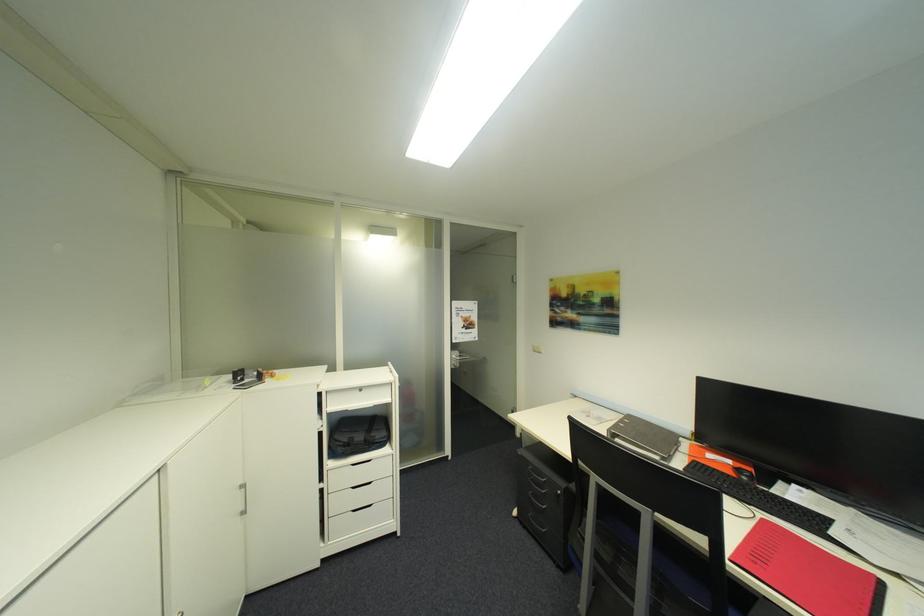
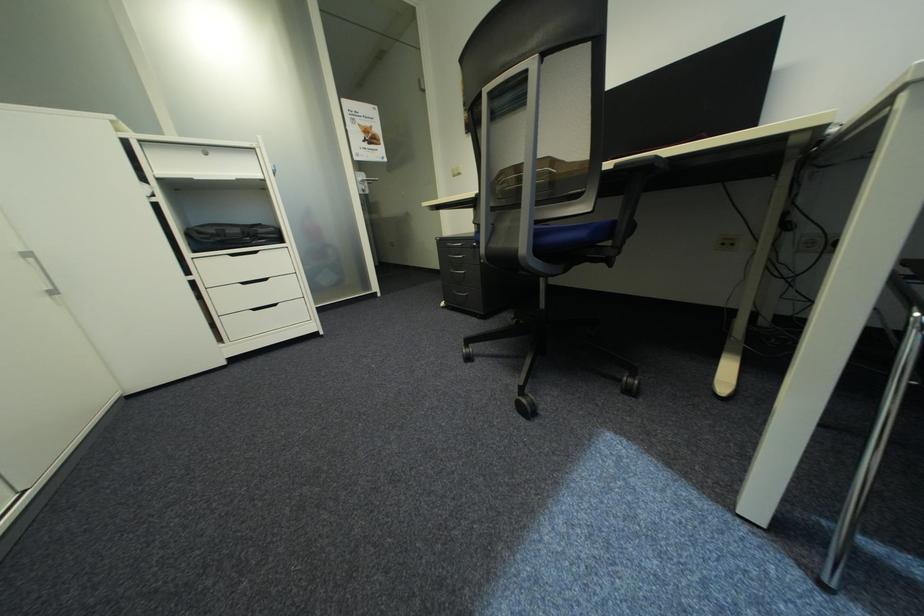
Find the pixel in the second image that matches pixel 330 485 in the first image.

(199, 278)